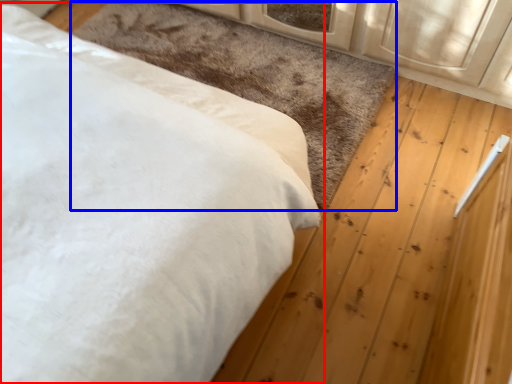
Question: Which of the following is the closest to the observer, bed (highlighted by a red box) or mat (highlighted by a blue box)?

Choices:
 (A) bed
 (B) mat

Answer: (A)